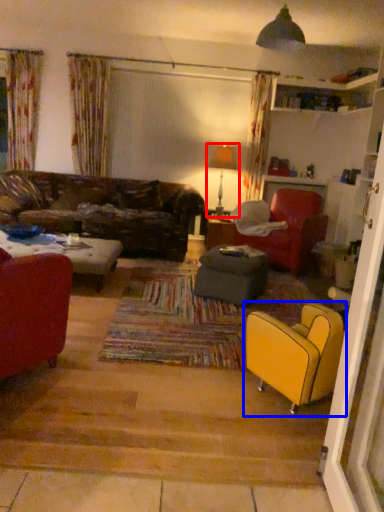
Question: Which of the following is the farthest to the observer, lamp (highlighted by a red box) or chair (highlighted by a blue box)?

Choices:
 (A) lamp
 (B) chair

Answer: (A)